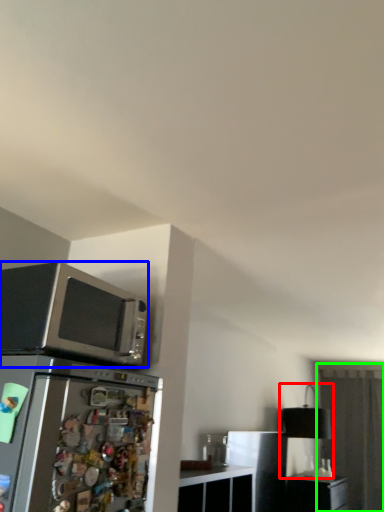
Question: Which is farther away from lamp (highlighted by a red box)? microwave oven (highlighted by a blue box) or glass door (highlighted by a green box)?

Choices:
 (A) microwave oven
 (B) glass door

Answer: (A)